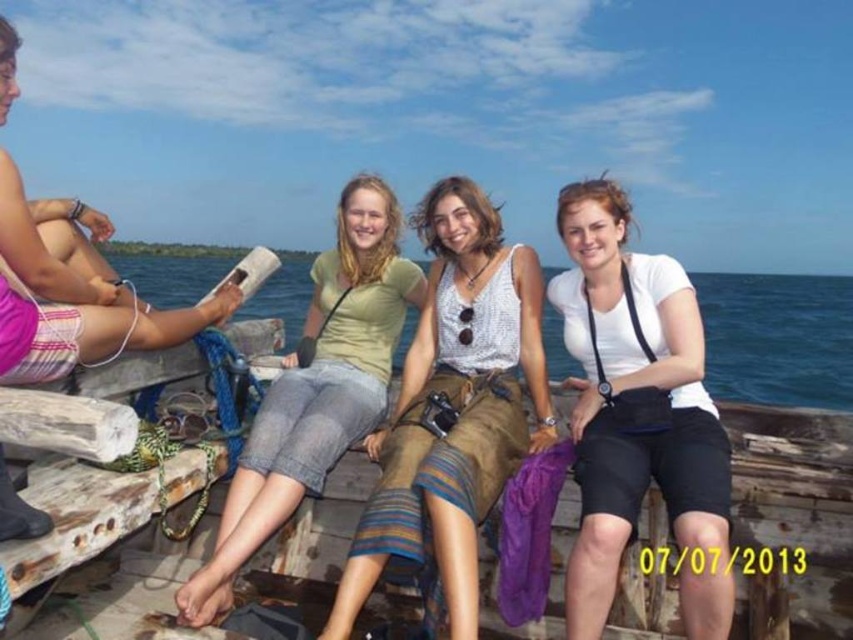
You are standing on the dock and want to know if the blue water at center is higher or lower than the pink woven shorts at left. Based on the scene, what can you determine?

The blue water at center is much taller than the pink woven shorts at left, so it is higher.

In the scene shown: You are a photographer trying to capture a candid shot of the denim shorts at center and the pink woven shorts at left. Since you want to emphasize the size difference between them, which one should you zoom in on more?

The denim shorts at center is smaller than the pink woven shorts at left, so you should zoom in more on the denim shorts at center to emphasize their smaller size compared to the larger pink woven shorts at left.

You are a photographer standing on the wooden dock by the sea. You want to take a photo of the denim shorts at center and the pink woven shorts at left. The minimum distance required for your camera to focus both subjects clearly is 10 feet. Can you capture both subjects in focus without moving closer or farther away?

The distance between the denim shorts at center and pink woven shorts at left is 8.50 feet, which is less than the 10 feet minimum required for your camera to focus both clearly. Therefore, you can capture both subjects in focus without adjusting your position.